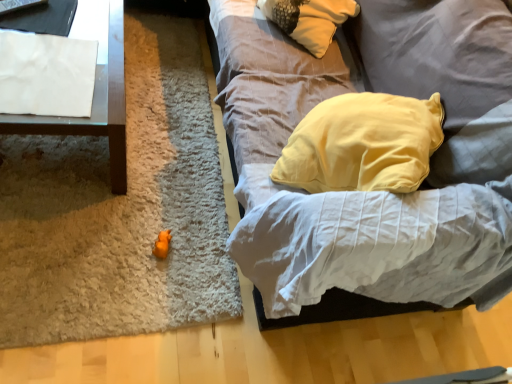
Describe the element at coordinates (162, 244) in the screenshot. This screenshot has height=384, width=512. I see `orange rubber duck at center` at that location.

The width and height of the screenshot is (512, 384). What do you see at coordinates (381, 193) in the screenshot?
I see `soft gray fabric couch at center` at bounding box center [381, 193].

Find the location of a particular element. The image size is (512, 384). white paper at left is located at coordinates (94, 90).

At what (x,y) coordinates should I click in order to perform the action: click on orange rubber duck at center. Please return your answer as a coordinate pair (x, y). Image resolution: width=512 pixels, height=384 pixels. Looking at the image, I should click on (162, 244).

From the image's perspective, which one is positioned higher, white paper at upper left or soft gray fabric couch at center?

soft gray fabric couch at center, from the image's perspective.

Is white paper at upper left turned away from soft gray fabric couch at center?

white paper at upper left is not turned away from soft gray fabric couch at center.

From a real-world perspective, is white paper at upper left above or below soft gray fabric couch at center?

Clearly, from a real-world perspective, white paper at upper left is below soft gray fabric couch at center.

Considering the relative positions of soft gray fabric couch at center and orange plush mat at center in the image provided, is soft gray fabric couch at center to the left of orange plush mat at center from the viewer's perspective?

In fact, soft gray fabric couch at center is to the right of orange plush mat at center.

Is soft gray fabric couch at center turned away from orange plush mat at center?

That's not correct — soft gray fabric couch at center is not looking away from orange plush mat at center.

In the scene shown: Considering the relative sizes of soft gray fabric couch at center and orange plush mat at center in the image provided, is soft gray fabric couch at center thinner than orange plush mat at center?

Yes.

Measure the distance between soft gray fabric couch at center and orange plush mat at center.

A distance of 21.57 inches exists between soft gray fabric couch at center and orange plush mat at center.

Is white paper at upper left positioned with its back to orange rubber duck at center?

No, orange rubber duck at center is not at the back of white paper at upper left.

From a real-world perspective, who is located higher, white paper at upper left or orange rubber duck at center?

white paper at upper left is physically above.

Does white paper at upper left have a lesser width compared to orange rubber duck at center?

Incorrect, the width of white paper at upper left is not less than that of orange rubber duck at center.

From their relative heights in the image, would you say white paper at upper left is taller or shorter than orange rubber duck at center?

Considering their sizes, white paper at upper left has less height than orange rubber duck at center.

From the picture: In terms of width, does white paper at upper left look wider or thinner when compared to orange plush mat at center?

Clearly, white paper at upper left has less width compared to orange plush mat at center.

Where is `mat behind the white paper at upper left`? The width and height of the screenshot is (512, 384). mat behind the white paper at upper left is located at coordinates pyautogui.click(x=120, y=211).

Considering the positions of objects white paper at upper left and orange plush mat at center in the image provided, who is behind, white paper at upper left or orange plush mat at center?

orange plush mat at center is further away from the camera.

From a real-world perspective, is soft gray fabric couch at center on white paper at left?

A: Yes, from a real-world perspective, soft gray fabric couch at center is over white paper at left

Does soft gray fabric couch at center appear on the right side of white paper at left?

Indeed, soft gray fabric couch at center is positioned on the right side of white paper at left.

Does soft gray fabric couch at center touch white paper at left?

No, soft gray fabric couch at center is not touching white paper at left.

Is soft gray fabric couch at center inside or outside of orange rubber duck at center?

soft gray fabric couch at center is located beyond the bounds of orange rubber duck at center.

Based on the photo, is soft gray fabric couch at center turned away from orange rubber duck at center?

No, soft gray fabric couch at center is not facing the opposite direction of orange rubber duck at center.

Considering the relative positions of soft gray fabric couch at center and orange rubber duck at center in the image provided, is soft gray fabric couch at center behind orange rubber duck at center?

No.

Does soft gray fabric couch at center have a lesser height compared to orange rubber duck at center?

In fact, soft gray fabric couch at center may be taller than orange rubber duck at center.

Would you say white paper at upper left is part of white paper at left's contents?

Absolutely, white paper at upper left is inside white paper at left.

Image resolution: width=512 pixels, height=384 pixels. I want to click on sheet that appears behind the white paper at left, so click(46, 74).

Considering the relative sizes of white paper at left and white paper at upper left in the image provided, is white paper at left taller than white paper at upper left?

Yes, white paper at left is taller than white paper at upper left.

I want to click on studio couch above the white paper at upper left (from a real-world perspective), so click(x=381, y=193).

Identify the location of studio couch lying in front of the orange plush mat at center. (381, 193).

From the image, which object appears to be farther from orange rubber duck at center, white paper at left or white paper at upper left?

white paper at upper left lies further to orange rubber duck at center than the other object.

Which object lies further to the anchor point orange rubber duck at center, white paper at left or orange plush mat at center?

white paper at left is positioned further to the anchor orange rubber duck at center.

Based on their spatial positions, is soft gray fabric couch at center or orange rubber duck at center further from white paper at left?

soft gray fabric couch at center is positioned further to the anchor white paper at left.

When comparing their distances from orange rubber duck at center, does orange plush mat at center or white paper at upper left seem further?

white paper at upper left is positioned further to the anchor orange rubber duck at center.

Considering their positions, is orange plush mat at center positioned further to soft gray fabric couch at center than white paper at upper left?

The object further to soft gray fabric couch at center is white paper at upper left.

Considering their positions, is white paper at upper left positioned closer to white paper at left than orange rubber duck at center?

Among the two, white paper at upper left is located nearer to white paper at left.

From the picture: Considering their positions, is orange rubber duck at center positioned closer to white paper at upper left than orange plush mat at center?

Based on the image, orange plush mat at center appears to be nearer to white paper at upper left.

Which object lies further to the anchor point white paper at left, orange plush mat at center or white paper at upper left?

Based on the image, orange plush mat at center appears to be further to white paper at left.

Identify the location of sheet situated between white paper at left and soft gray fabric couch at center from left to right. Image resolution: width=512 pixels, height=384 pixels. (46, 74).

This screenshot has height=384, width=512. Identify the location of toy between white paper at left and soft gray fabric couch at center from left to right. (162, 244).

Locate an element on the screen. sheet that lies between white paper at left and orange plush mat at center from top to bottom is located at coordinates (46, 74).

The image size is (512, 384). I want to click on mat between white paper at left and orange rubber duck at center vertically, so click(x=120, y=211).